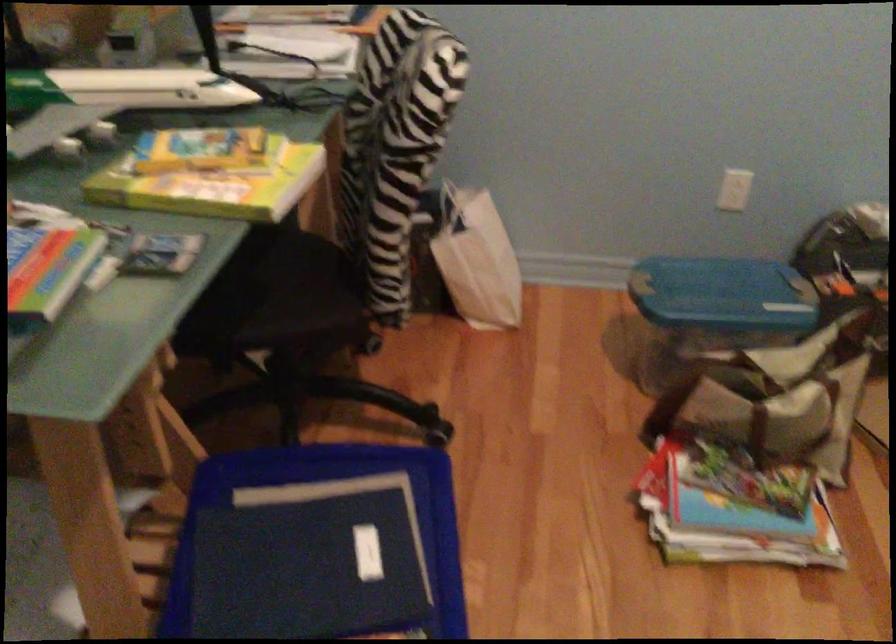
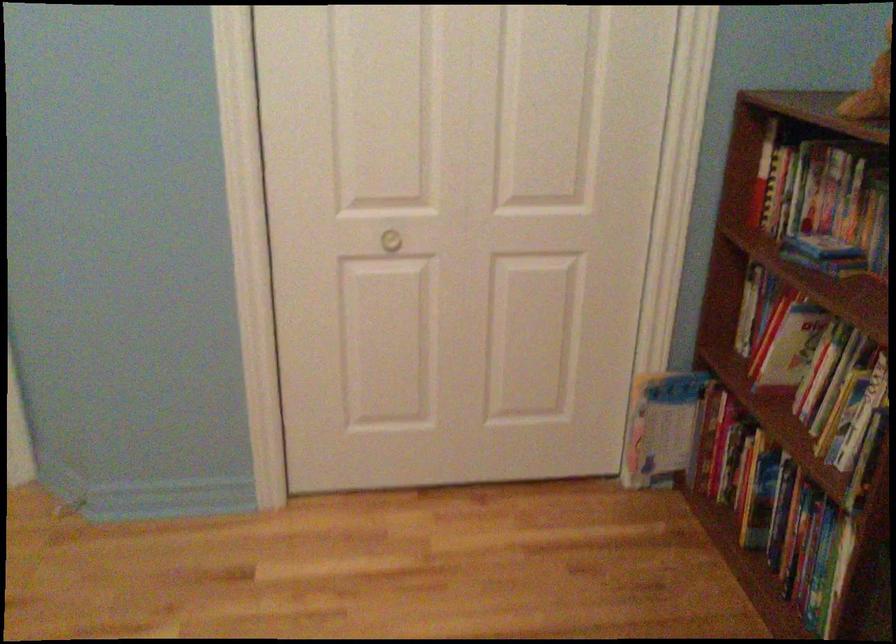
First-person continuous shooting, in which direction is the camera rotating?

The rotation direction of the camera is right-down.